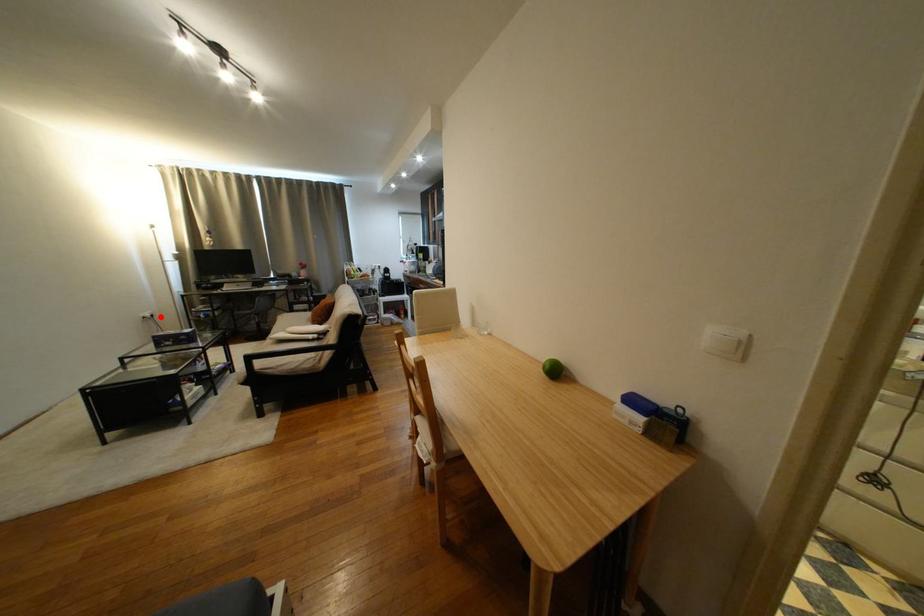
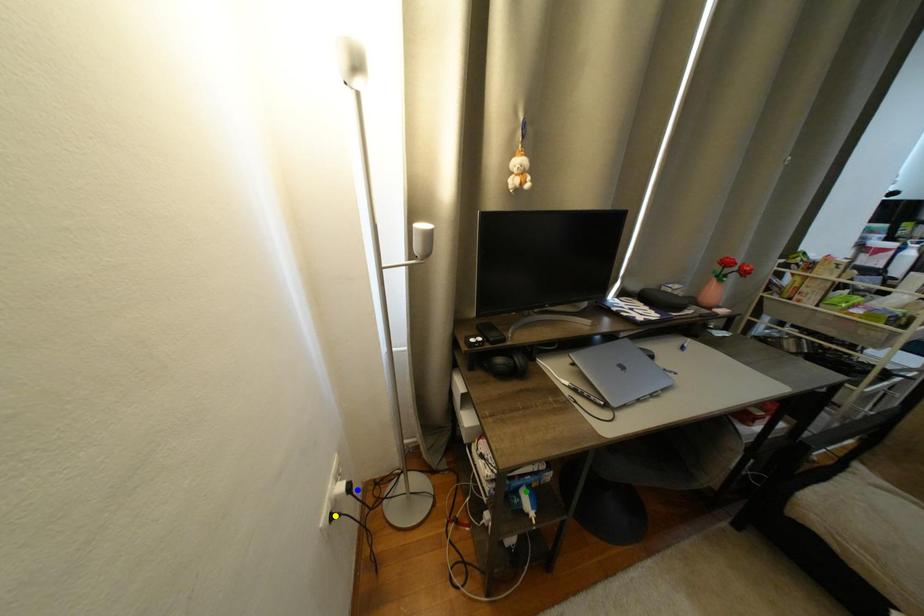
Question: I am providing you with two images of the same scene from different viewpoints. A red point is marked on the first image. You are given multiple points on the second image. Can you choose the point in image 2 that corresponds to the point in image 1?

Choices:
 (A) yellow point
 (B) blue point
 (C) green point

Answer: (B)